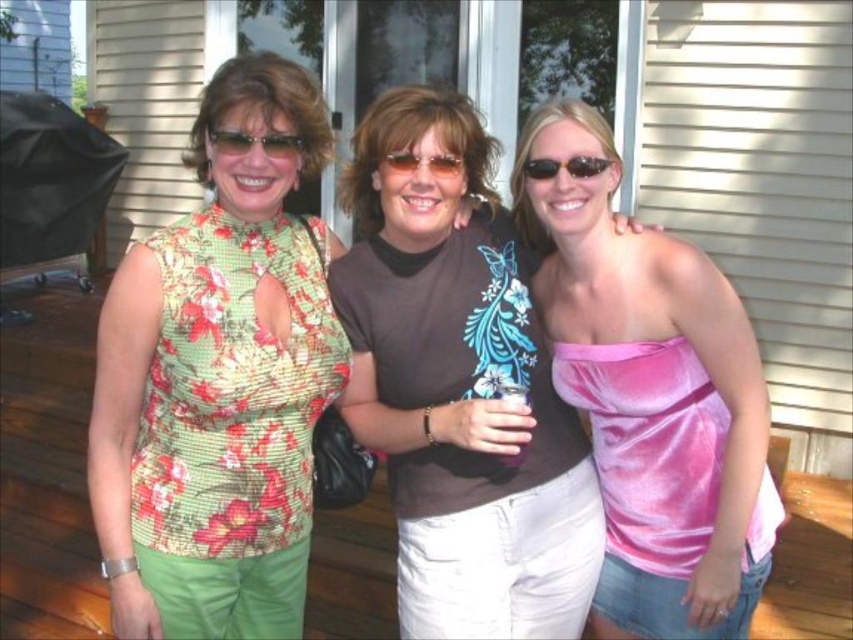
Question: In this image, where is pink satin tank top at center located relative to sunglasses at center?

Choices:
 (A) right
 (B) left

Answer: (A)

Question: Does green floral top at center come behind pink satin tank top at center?

Choices:
 (A) no
 (B) yes

Answer: (A)

Question: Considering the real-world distances, which object is farthest from the brown cotton t-shirt at center?

Choices:
 (A) matte plastic sunglasses at center
 (B) sunglasses at center
 (C) green floral top at center

Answer: (B)

Question: Is green floral top at center above brown cotton t-shirt at center?

Choices:
 (A) yes
 (B) no

Answer: (A)

Question: Which object is farther from the camera taking this photo?

Choices:
 (A) green floral top at center
 (B) pink satin tank top at center

Answer: (B)

Question: Which point is closer to the camera?

Choices:
 (A) brown cotton t-shirt at center
 (B) green floral top at center
 (C) sunglasses at center

Answer: (B)